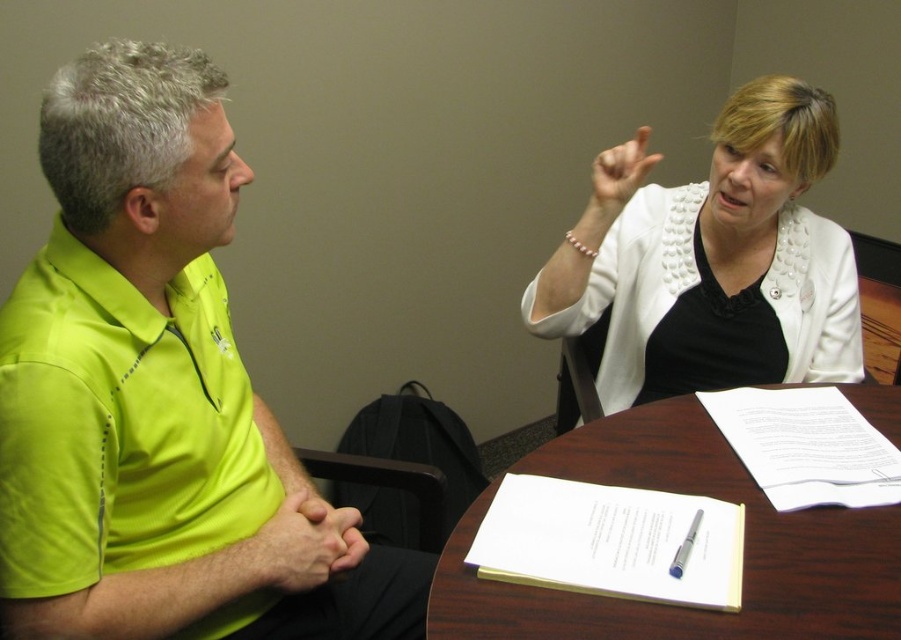
Does yellow matte/gloved hand at lower left appear under white matte hand at upper right?

Indeed, yellow matte/gloved hand at lower left is positioned under white matte hand at upper right.

Which is behind, point (339, 536) or point (638, 156)?

The point (638, 156) is behind.

Image resolution: width=901 pixels, height=640 pixels. Identify the location of yellow matte/gloved hand at lower left. (303, 545).

The image size is (901, 640). Find the location of `yellow matte/gloved hand at lower left`. yellow matte/gloved hand at lower left is located at coordinates (303, 545).

The height and width of the screenshot is (640, 901). What are the coordinates of `wooden table at lower right` in the screenshot? It's located at (690, 493).

Consider the image. Does neon yellow shirt at left have a larger size compared to white matte hand at upper right?

Yes.

Locate an element on the screen. This screenshot has width=901, height=640. neon yellow shirt at left is located at coordinates (150, 387).